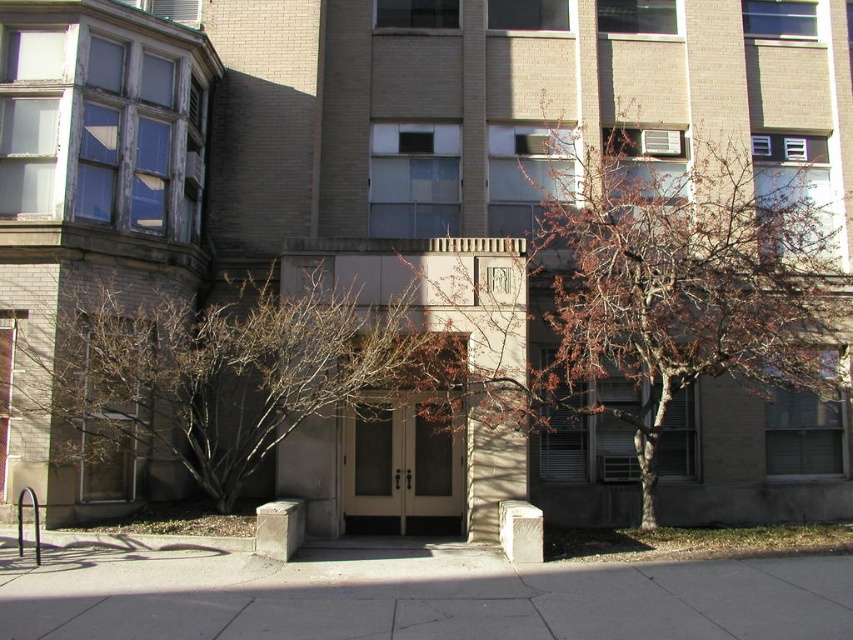
Is point (328, 566) more distant than point (247, 310)?

No, (328, 566) is in front of (247, 310).

In the scene shown: Does gray concrete sidewalk at center appear on the left side of bare branches at center?

Yes, gray concrete sidewalk at center is to the left of bare branches at center.

Is point (204, 552) in front of point (22, 412)?

Yes, point (204, 552) is closer to viewer.

Where is `gray concrete sidewalk at center`? Image resolution: width=853 pixels, height=640 pixels. gray concrete sidewalk at center is located at coordinates (418, 596).

Is point (601, 292) closer to viewer compared to point (84, 432)?

No, it is behind (84, 432).

How distant is brown textured tree at center from bare branches at center?

brown textured tree at center is 7.98 meters from bare branches at center.

Does point (643, 513) come closer to viewer compared to point (260, 314)?

No, it is behind (260, 314).

Locate an element on the screen. brown textured tree at center is located at coordinates (647, 300).

Is point (821, 298) behind point (154, 566)?

Yes.

Is brown textured tree at center bigger than gray concrete sidewalk at center?

Yes, brown textured tree at center is bigger than gray concrete sidewalk at center.

Between point (606, 161) and point (598, 570), which one is positioned behind?

The point (606, 161) is behind.

You are a GUI agent. You are given a task and a screenshot of the screen. Output one action in this format:
    pyautogui.click(x=<x>, y=<y>)
    Task: Click on the brown textured tree at center
    The width and height of the screenshot is (853, 640).
    Given the screenshot: What is the action you would take?
    pyautogui.click(x=647, y=300)